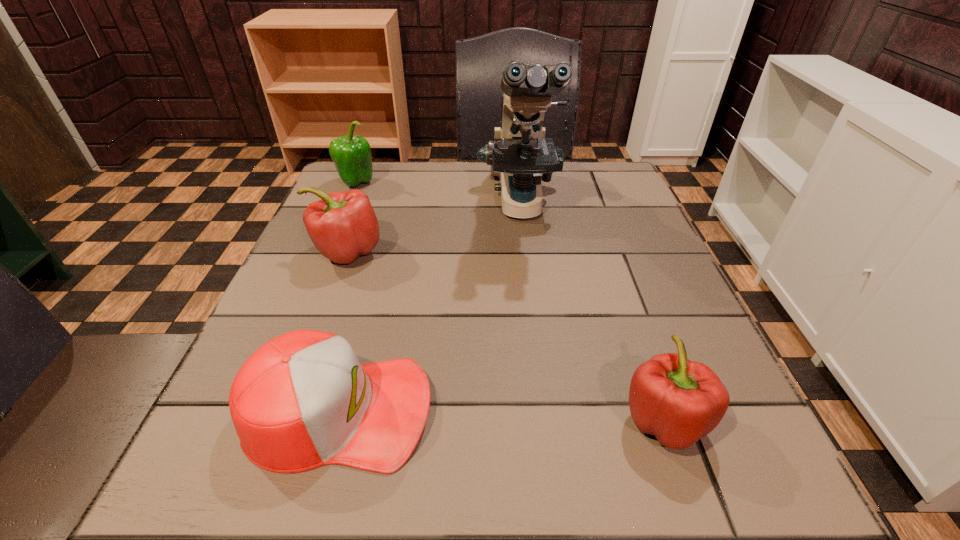
Where is `object present at the near right corner`? object present at the near right corner is located at coordinates (679, 401).

At what (x,y) coordinates should I click in order to perform the action: click on vacant space at the far edge. Please return your answer as a coordinate pair (x, y). Looking at the image, I should click on (404, 183).

Where is `free space at the near edge of the desktop`? free space at the near edge of the desktop is located at coordinates (540, 470).

You are a GUI agent. You are given a task and a screenshot of the screen. Output one action in this format:
    pyautogui.click(x=<x>, y=<y>)
    Task: Click on the vacant space at the left edge
    
    Given the screenshot: What is the action you would take?
    pyautogui.click(x=276, y=313)

Locate an element on the screen. free space at the right edge is located at coordinates (590, 247).

The width and height of the screenshot is (960, 540). Identify the location of blank space at the near left corner. click(x=250, y=490).

Image resolution: width=960 pixels, height=540 pixels. Identify the location of vacant space at the far right corner. (568, 176).

This screenshot has width=960, height=540. I want to click on free space that is in between the second shortest bell pepper and the microscope, so click(x=434, y=228).

Locate an element on the screen. vacant region between the nearest bell pepper and the farthest bell pepper is located at coordinates (511, 301).

The image size is (960, 540). I want to click on vacant region between the microscope and the third tallest object, so click(434, 228).